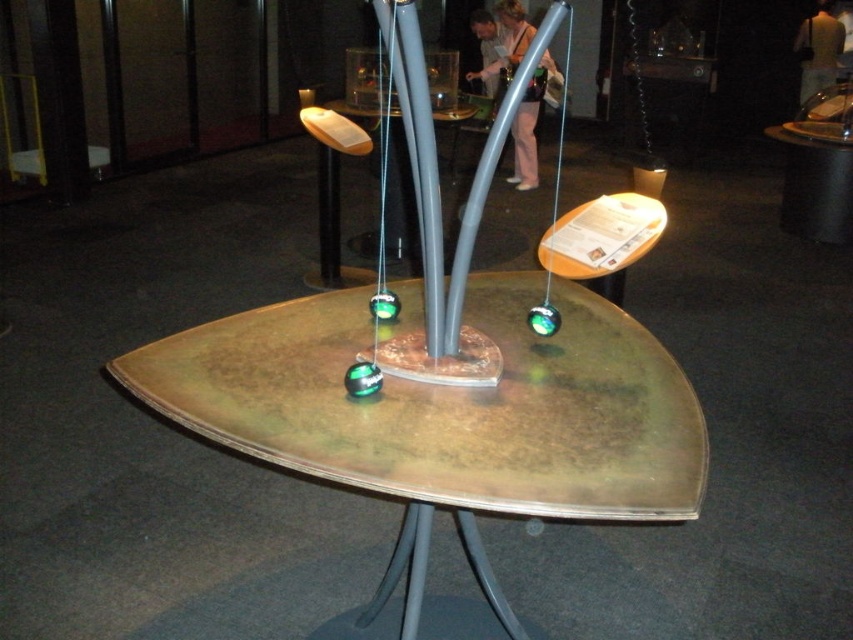
You are a maintenance worker tasked with moving both the bronze metallic table at center and the metallic gray table at center to a storage room 10 feet away. If you can carry one table at a time, what is the minimum total distance you must walk to move both tables from their current position to the storage room?

The minimum total distance you must walk is 20 feet. You can carry one table to the storage room 10 feet away and return 10 feet to carry the second table, totaling 20 feet.

You are standing in front of an interactive physics exhibit and need to locate the bronze metallic table at center. What are the coordinates where you should look to find it?

The bronze metallic table at center is located at coordinates point (447, 417).